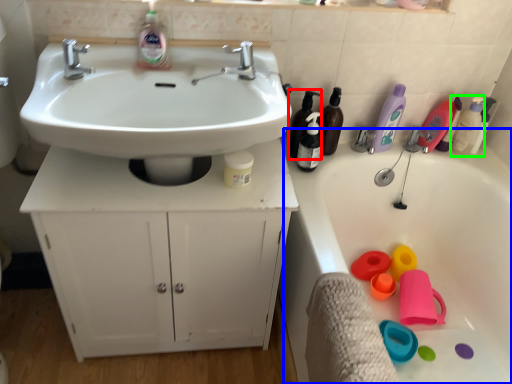
Question: Considering the real-world distances, which object is farthest from toiletry (highlighted by a red box)? bath (highlighted by a blue box) or cleaning product (highlighted by a green box)?

Choices:
 (A) bath
 (B) cleaning product

Answer: (B)